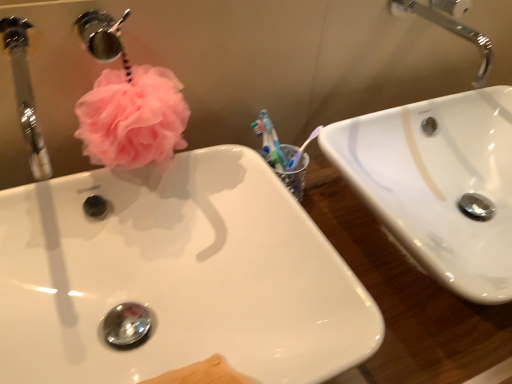
Question: Is pink fluffy loofah at upper left shorter than brushed metal faucet at upper left?

Choices:
 (A) yes
 (B) no

Answer: (B)

Question: Is pink fluffy loofah at upper left oriented away from brushed metal faucet at upper left?

Choices:
 (A) yes
 (B) no

Answer: (B)

Question: Is pink fluffy loofah at upper left far from brushed metal faucet at upper left?

Choices:
 (A) no
 (B) yes

Answer: (A)

Question: Is pink fluffy loofah at upper left next to brushed metal faucet at upper left and touching it?

Choices:
 (A) no
 (B) yes

Answer: (B)

Question: Considering the relative positions of pink fluffy loofah at upper left and brushed metal faucet at upper left in the image provided, is pink fluffy loofah at upper left to the right of brushed metal faucet at upper left from the viewer's perspective?

Choices:
 (A) no
 (B) yes

Answer: (B)

Question: Does pink fluffy loofah at upper left contain brushed metal faucet at upper left?

Choices:
 (A) no
 (B) yes

Answer: (A)

Question: From the image's perspective, is white glossy sink at upper right, which appears as the second sink when viewed from the left, on pink fluffy loofah at upper left?

Choices:
 (A) no
 (B) yes

Answer: (A)

Question: Is white glossy sink at upper right, the first sink in the right-to-left sequence, far away from pink fluffy loofah at upper left?

Choices:
 (A) yes
 (B) no

Answer: (B)

Question: From a real-world perspective, is white glossy sink at upper right, which appears as the second sink when viewed from the left, on top of pink fluffy loofah at upper left?

Choices:
 (A) yes
 (B) no

Answer: (B)

Question: From the image's perspective, is white glossy sink at upper right, which appears as the second sink when viewed from the left, below pink fluffy loofah at upper left?

Choices:
 (A) no
 (B) yes

Answer: (B)

Question: Can you confirm if white glossy sink at upper right, the first sink in the right-to-left sequence, is positioned to the left of pink fluffy loofah at upper left?

Choices:
 (A) yes
 (B) no

Answer: (B)

Question: Is the depth of white glossy sink at upper right, the first sink in the right-to-left sequence, less than that of pink fluffy loofah at upper left?

Choices:
 (A) no
 (B) yes

Answer: (A)

Question: Is white glossy sink at center, which is the 2th sink from right to left, behind white glossy sink at upper right, which appears as the second sink when viewed from the left?

Choices:
 (A) yes
 (B) no

Answer: (B)